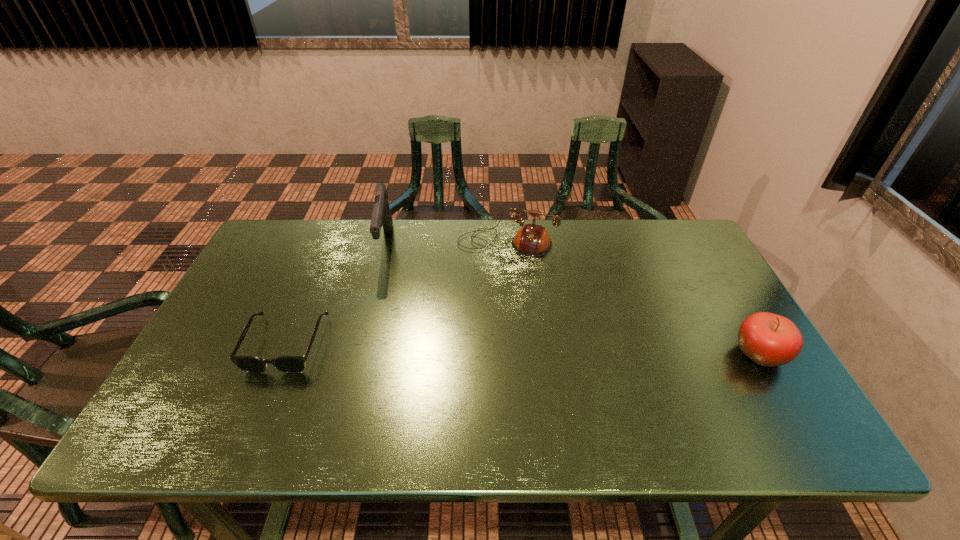
Where is `sunglasses`? The height and width of the screenshot is (540, 960). sunglasses is located at coordinates (288, 364).

This screenshot has height=540, width=960. Find the location of `the shortest object`. the shortest object is located at coordinates (288, 364).

At what (x,y) coordinates should I click in order to perform the action: click on apple. Please return your answer as a coordinate pair (x, y). Looking at the image, I should click on (768, 339).

The image size is (960, 540). I want to click on telephone, so click(x=533, y=240).

Identify the location of gun. The width and height of the screenshot is (960, 540). (381, 216).

What are the coordinates of `the tallest object` in the screenshot? It's located at (381, 216).

You are a GUI agent. You are given a task and a screenshot of the screen. Output one action in this format:
    pyautogui.click(x=<x>, y=<y>)
    Task: Click on the free space located 0.090m at the front lenses of the shortest object
    This screenshot has height=540, width=960.
    Given the screenshot: What is the action you would take?
    pyautogui.click(x=260, y=407)

Image resolution: width=960 pixels, height=540 pixels. In order to click on vacant area situated on the left of the apple in this screenshot , I will do `click(633, 354)`.

Locate an element on the screen. Image resolution: width=960 pixels, height=540 pixels. vacant region located on the rotary dial of the third object from left to right is located at coordinates (481, 292).

Find the location of a particular element. Image resolution: width=960 pixels, height=540 pixels. free space located on the rotary dial of the third object from left to right is located at coordinates (450, 362).